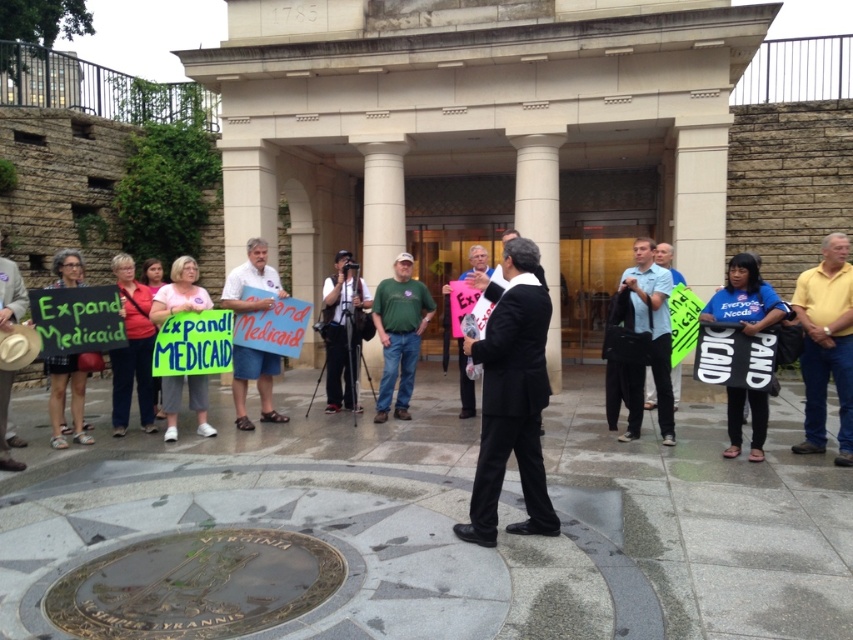
Does black suit at center appear under pink paper sign at center?

Actually, black suit at center is above pink paper sign at center.

At what (x,y) coordinates should I click in order to perform the action: click on black suit at center. Please return your answer as a coordinate pair (x, y). Looking at the image, I should click on (512, 400).

Locate an element on the screen. This screenshot has width=853, height=640. black suit at center is located at coordinates (512, 400).

Can you confirm if blue denim shorts at center is taller than pink paper sign at center?

Yes, blue denim shorts at center is taller than pink paper sign at center.

Does blue denim shorts at center have a lesser width compared to pink paper sign at center?

In fact, blue denim shorts at center might be wider than pink paper sign at center.

Locate an element on the screen. blue denim shorts at center is located at coordinates (256, 384).

Who is more forward, (822,353) or (646,298)?

Point (822,353) is more forward.

Does yellow cotton shirt at right appear over blue fabric shirt at center?

No.

What do you see at coordinates (827, 346) in the screenshot? This screenshot has width=853, height=640. I see `yellow cotton shirt at right` at bounding box center [827, 346].

Locate an element on the screen. yellow cotton shirt at right is located at coordinates (827, 346).